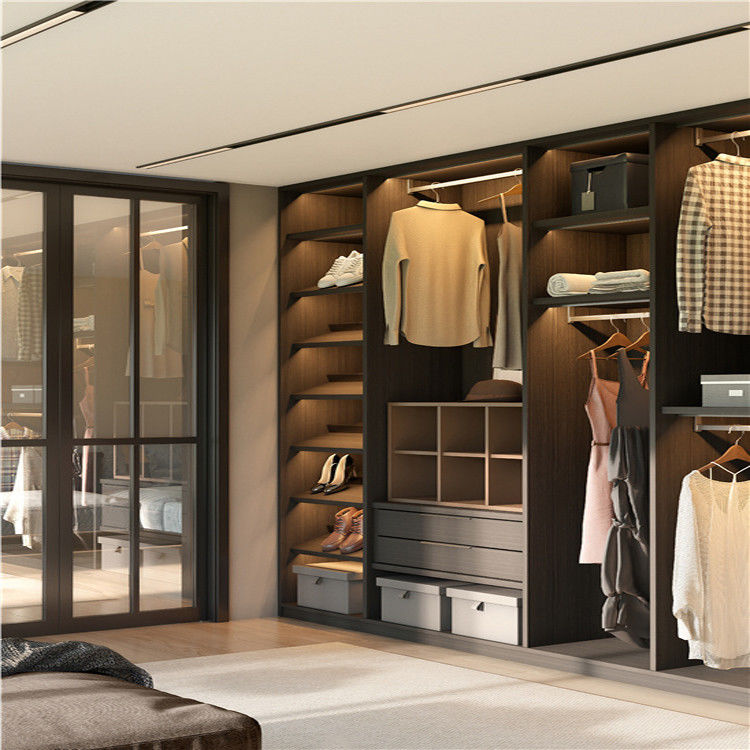
The height and width of the screenshot is (750, 750). Find the location of `wooden hangers`. wooden hangers is located at coordinates (735, 450), (620, 337).